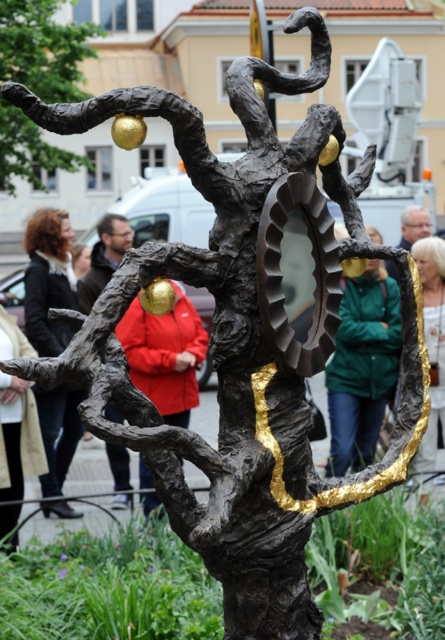
You are an art student analyzing the sculpture. You notice the bronze textured tree at upper left and the golden metallic hair at upper right. Which element would appear closer to you when observing the sculpture from the front?

The bronze textured tree at upper left appears closer to you because it is further to the viewer than the golden metallic hair at upper right.